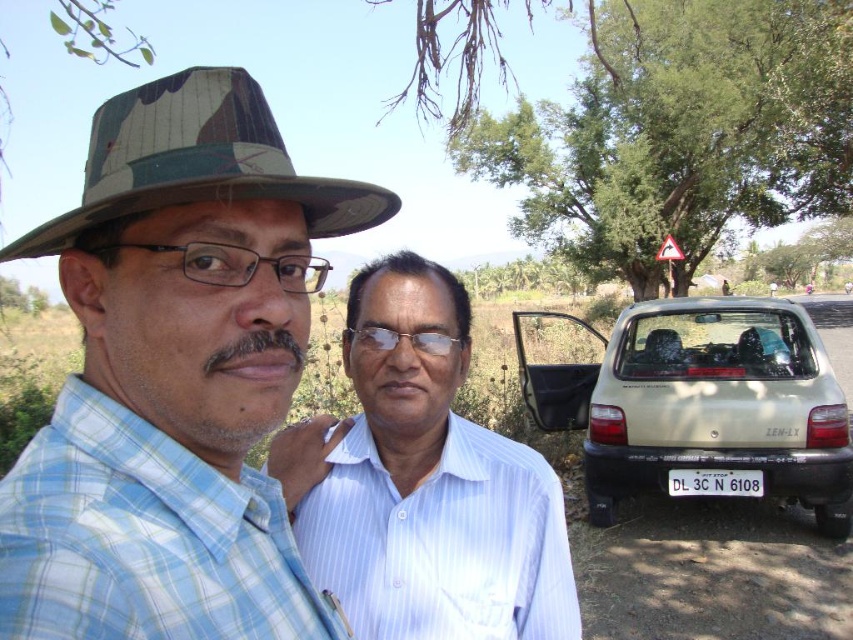
Is camouflage fabric hat at upper left taller than beige matte hatchback at lower right?

No.

Between camouflage fabric hat at upper left and beige matte hatchback at lower right, which one is positioned higher?

camouflage fabric hat at upper left

Is point (68, 388) behind point (827, 524)?

No, it is not.

Locate an element on the screen. camouflage fabric hat at upper left is located at coordinates (173, 376).

Locate an element on the screen. This screenshot has height=640, width=853. green leafy tree at upper right is located at coordinates (680, 132).

Does point (688, 147) lie behind point (537, 328)?

Yes, point (688, 147) is behind point (537, 328).

Where is `green leafy tree at upper right`? green leafy tree at upper right is located at coordinates (680, 132).

What do you see at coordinates (425, 483) in the screenshot? The height and width of the screenshot is (640, 853). I see `white striped shirt at center` at bounding box center [425, 483].

Between point (370, 576) and point (566, 380), which one is positioned behind?

Positioned behind is point (566, 380).

In order to click on white striped shirt at center in this screenshot , I will do `click(425, 483)`.